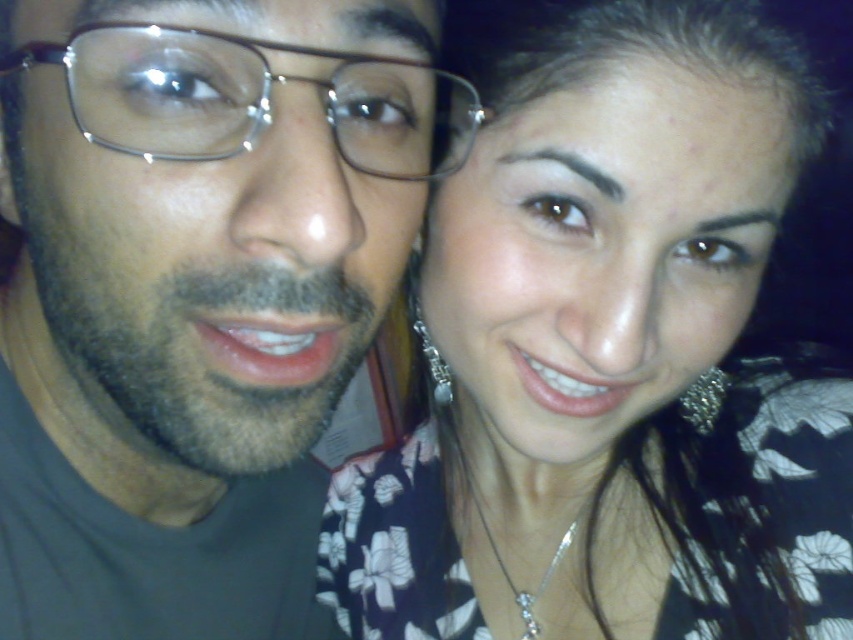
Question: Estimate the real-world distances between objects in this image. Which object is closer to the brownhaireyebrow at center?

Choices:
 (A) brownhaireyebrow at upper center
 (B) dark brown hair at upper center
 (C) metallic frame glasses at left
 (D) floral-patterned blouse at center

Answer: (A)

Question: Is the position of dark brown hair at upper center less distant than that of brownhaireyebrow at upper center?

Choices:
 (A) no
 (B) yes

Answer: (B)

Question: Can you confirm if matte black face at left is smaller than dark brown hair at upper center?

Choices:
 (A) yes
 (B) no

Answer: (B)

Question: Which point appears closest to the camera in this image?

Choices:
 (A) (231, 500)
 (B) (445, 156)
 (C) (462, 637)
 (D) (416, 19)

Answer: (D)

Question: Is metallic frame glasses at left thinner than brownhaireyebrow at center?

Choices:
 (A) no
 (B) yes

Answer: (A)

Question: Considering the real-world distances, which object is closest to the floral-patterned blouse at center?

Choices:
 (A) matte black face at left
 (B) dark brown hair at upper center
 (C) brownhaireyebrow at center

Answer: (A)